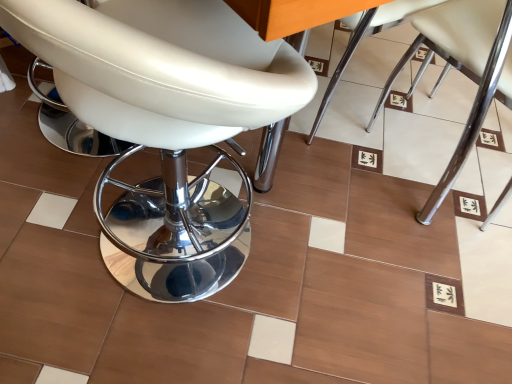
Question: Is white leather stool at left, which appears as the third chair when viewed from the right, looking in the opposite direction of white leather chair at center, the 1th chair viewed from the right?

Choices:
 (A) yes
 (B) no

Answer: (B)

Question: Can white leather chair at center, the 1th chair viewed from the right, be found inside white leather stool at left, which appears as the first chair when viewed from the left?

Choices:
 (A) yes
 (B) no

Answer: (B)

Question: Is the position of white leather stool at left, which appears as the first chair when viewed from the left, more distant than that of white leather chair at center, positioned as the 3th chair in left-to-right order?

Choices:
 (A) no
 (B) yes

Answer: (A)

Question: Is there a large distance between white leather stool at left, which appears as the third chair when viewed from the right, and white leather chair at center, the 1th chair viewed from the right?

Choices:
 (A) yes
 (B) no

Answer: (B)

Question: From a real-world perspective, is white leather stool at left, which appears as the first chair when viewed from the left, on white leather chair at center, the 1th chair viewed from the right?

Choices:
 (A) no
 (B) yes

Answer: (B)

Question: Does white leather stool at left, which appears as the first chair when viewed from the left, have a lesser height compared to white leather chair at center, the 1th chair viewed from the right?

Choices:
 (A) no
 (B) yes

Answer: (A)

Question: Considering the relative positions of white leather chair at center, positioned as the 3th chair in left-to-right order, and white leather stool at left, which appears as the third chair when viewed from the right, in the image provided, is white leather chair at center, positioned as the 3th chair in left-to-right order, to the right of white leather stool at left, which appears as the third chair when viewed from the right, from the viewer's perspective?

Choices:
 (A) no
 (B) yes

Answer: (B)

Question: Can you confirm if white leather chair at center, the 1th chair viewed from the right, is positioned to the left of white leather stool at left, which appears as the first chair when viewed from the left?

Choices:
 (A) yes
 (B) no

Answer: (B)

Question: Is white leather chair at center, the 1th chair viewed from the right, facing towards white leather stool at left, which appears as the first chair when viewed from the left?

Choices:
 (A) no
 (B) yes

Answer: (A)

Question: Are white leather chair at center, the 1th chair viewed from the right, and white leather stool at left, which appears as the first chair when viewed from the left, far apart?

Choices:
 (A) no
 (B) yes

Answer: (A)

Question: Is white leather chair at center, the 1th chair viewed from the right, bigger than white leather stool at left, which appears as the first chair when viewed from the left?

Choices:
 (A) yes
 (B) no

Answer: (B)

Question: From a real-world perspective, is white leather chair at center, positioned as the 3th chair in left-to-right order, physically above white leather stool at left, which appears as the first chair when viewed from the left?

Choices:
 (A) no
 (B) yes

Answer: (A)

Question: Is white leather chair at center, the 1th chair viewed from the right, completely or partially inside white leather chair at center, acting as the 2th chair starting from the right?

Choices:
 (A) no
 (B) yes

Answer: (A)